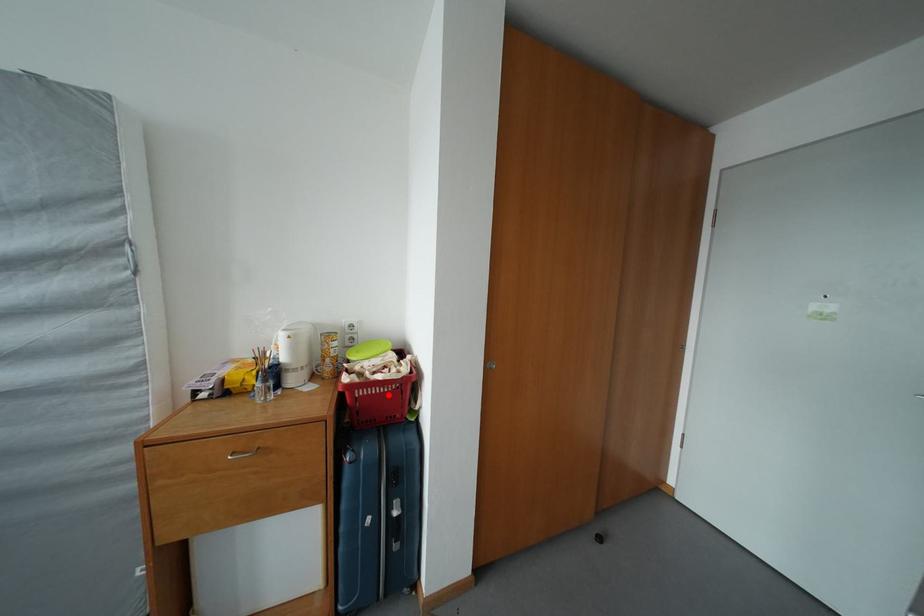
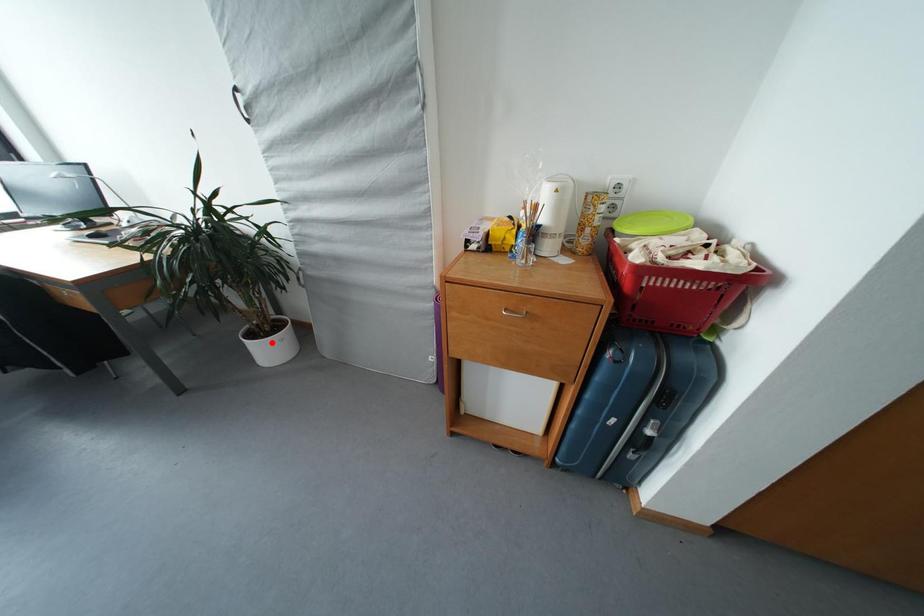
I am providing you with two images of the same scene from different viewpoints. A red point is marked on the first image and another point is marked on the second image. Is the marked point in image1 the same physical position as the marked point in image2?

No